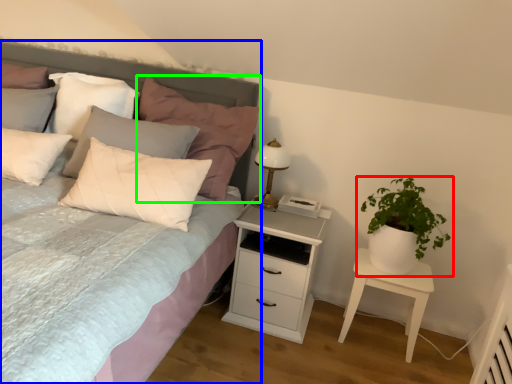
Question: Estimate the real-world distances between objects in this image. Which object is farther from houseplant (highlighted by a red box), bed (highlighted by a blue box) or pillow (highlighted by a green box)?

Choices:
 (A) bed
 (B) pillow

Answer: (A)